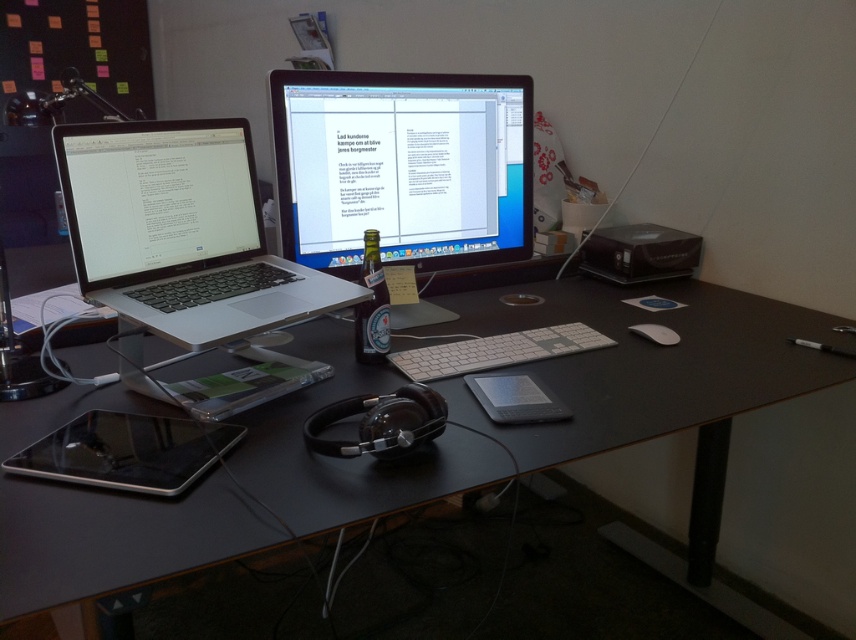
You are organizing cables for the workspace shown. You need to connect a new cable that requires 15 cm of space between the satin black monitor at center and the silver metallic laptop at left. Is there enough space based on their sizes?

The satin black monitor at center is wider than the silver metallic laptop at left. However, the question is about the space between them, not their widths. Since the description only states the monitor is wider but doesn not provide specific distance between them, we cannot determine if 15 cm of space is available. More information is needed.

You are standing in front of the desk and want to reach the point at coordinates (x=331, y=300). If your arm can extend 1.2 meters, can you comfortably reach that point?

The point at coordinates (x=331, y=300) is 1.17 meters away from the viewer. Since your arm can extend 1.2 meters, you can comfortably reach it.